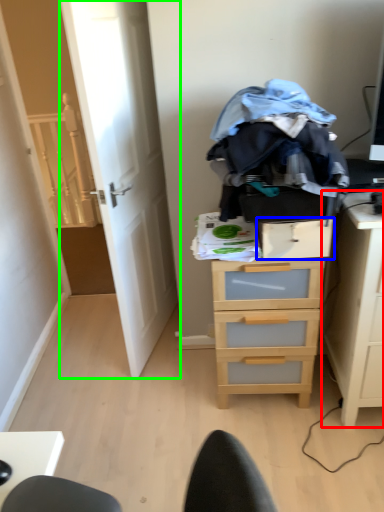
Question: Considering the real-world distances, which object is farthest from nightstand (highlighted by a red box)? drawer (highlighted by a blue box) or door (highlighted by a green box)?

Choices:
 (A) drawer
 (B) door

Answer: (B)